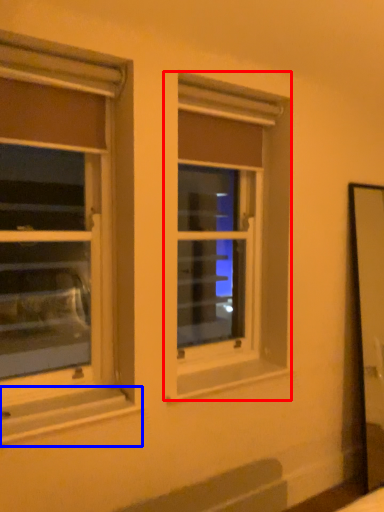
Question: Which object appears closest to the camera in this image, window (highlighted by a red box) or window sill (highlighted by a blue box)?

Choices:
 (A) window
 (B) window sill

Answer: (B)